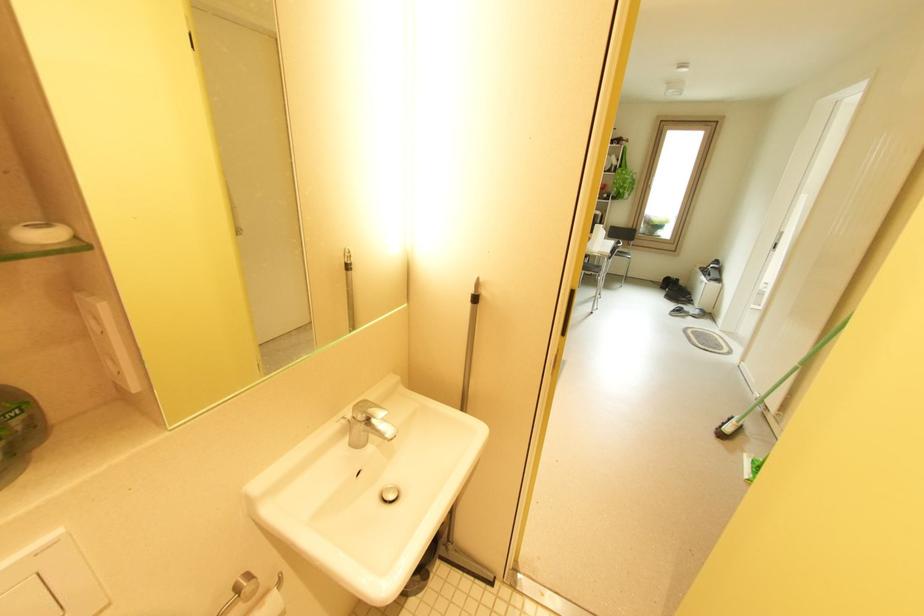
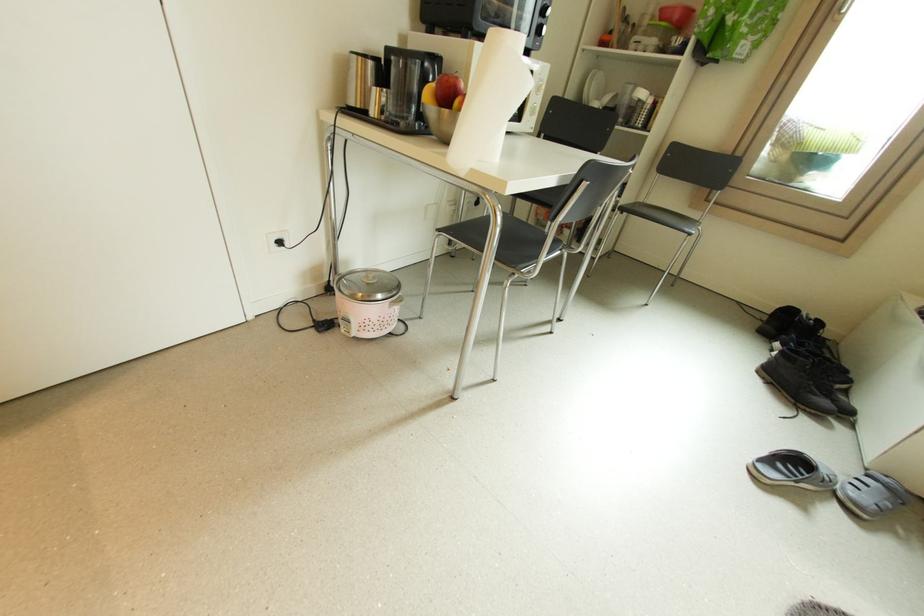
In the second image, find the point that corresponds to (x=685, y=310) in the first image.

(799, 463)